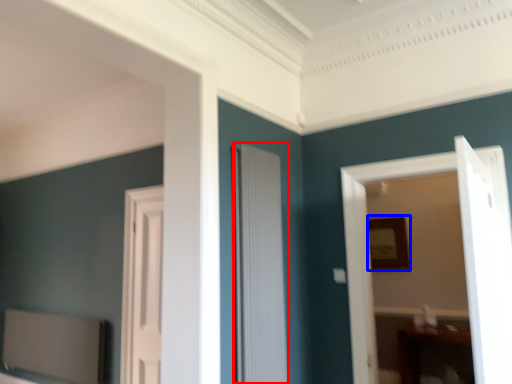
Question: Which point is further to the camera, door (highlighted by a red box) or picture frame (highlighted by a blue box)?

Choices:
 (A) door
 (B) picture frame

Answer: (B)